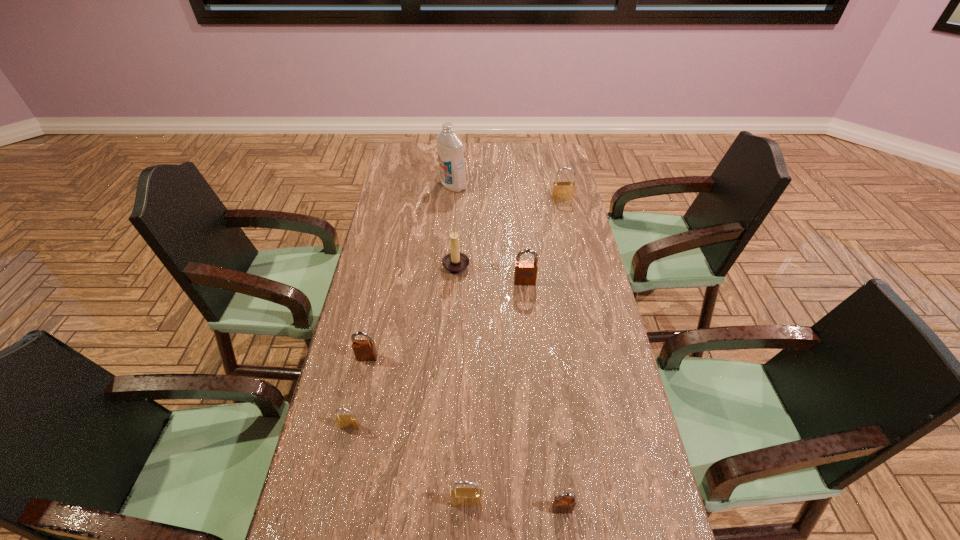
Where is `free point located on the front-facing side of the third nearest padlock`? The width and height of the screenshot is (960, 540). free point located on the front-facing side of the third nearest padlock is located at coordinates (331, 508).

The height and width of the screenshot is (540, 960). Identify the location of vacant space situated on the front-facing side of the smallest brown padlock. (566, 538).

Identify the location of object that is positioned at the right edge. This screenshot has height=540, width=960. (561, 190).

This screenshot has width=960, height=540. Identify the location of free space at the far edge. pos(475,154).

Where is `vacant space at the left edge`? Image resolution: width=960 pixels, height=540 pixels. vacant space at the left edge is located at coordinates (369, 368).

In the image, there is a desktop. Identify the location of vacant space at the far right corner. (547, 151).

This screenshot has width=960, height=540. Identify the location of vacant region between the second biggest brown padlock and the smallest brass padlock. (358, 392).

Locate an element on the screen. Image resolution: width=960 pixels, height=540 pixels. vacant point located between the third farthest object and the smallest brown padlock is located at coordinates (510, 387).

Where is `free space between the tallest object and the nearest brass padlock`? free space between the tallest object and the nearest brass padlock is located at coordinates (460, 344).

Identify the location of vacant point located between the third farthest object and the farthest object. (454, 225).